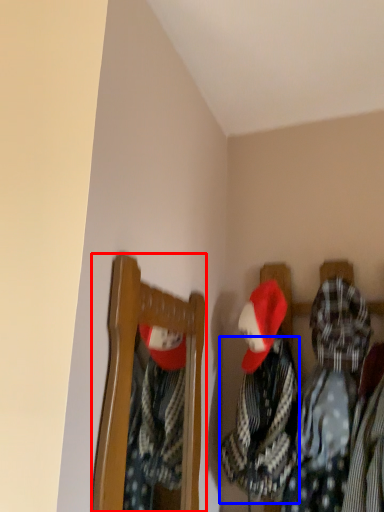
Question: Which object appears farthest to the camera in this image, furniture (highlighted by a red box) or clothing (highlighted by a blue box)?

Choices:
 (A) furniture
 (B) clothing

Answer: (B)